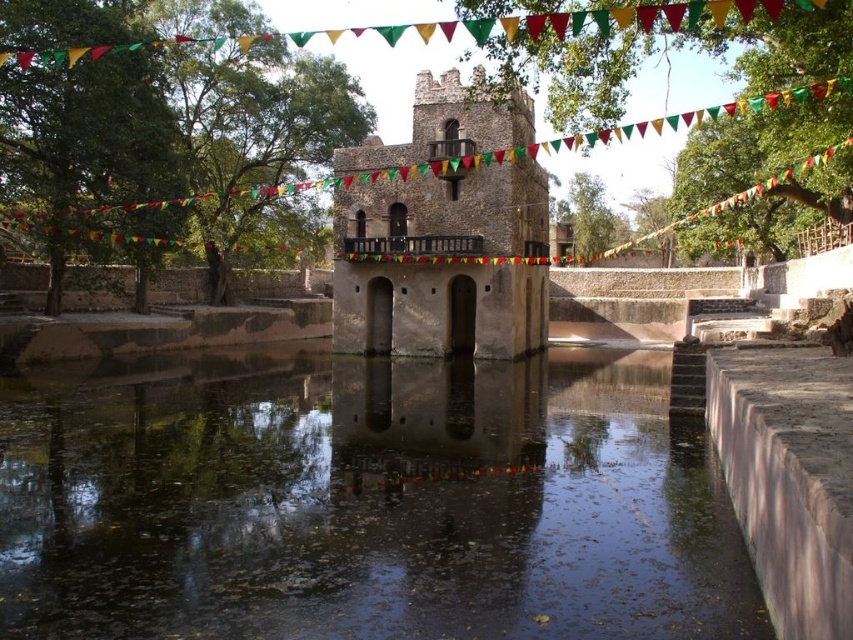
Question: Which object appears closest to the camera in this image?

Choices:
 (A) brown concrete river at center
 (B) brown stone tower at center

Answer: (A)

Question: Does brown concrete river at center have a smaller size compared to brown stone tower at center?

Choices:
 (A) no
 (B) yes

Answer: (A)

Question: Can you confirm if brown concrete river at center is positioned above brown stone tower at center?

Choices:
 (A) no
 (B) yes

Answer: (A)

Question: Which point appears farthest from the camera in this image?

Choices:
 (A) coord(457,296)
 (B) coord(386,576)

Answer: (A)

Question: Can you confirm if brown concrete river at center is positioned above brown stone tower at center?

Choices:
 (A) yes
 (B) no

Answer: (B)